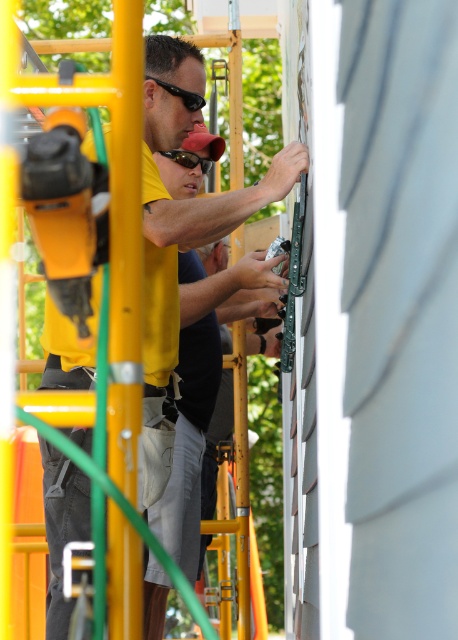
You are a safety inspector observing the construction site. You notice the yellow matte shirt at center and the black plastic goggles at upper center. Which object is closer to you?

The yellow matte shirt at center is closer to you because it is further to the viewer than the black plastic goggles at upper center.

You are a safety inspector checking the equipment on the scaffolding. You notice the yellow matte shirt at center and the black plastic goggles at upper center. Which object has a smaller width?

The yellow matte shirt at center has a smaller width than the black plastic goggles at upper center according to the description.

You are a safety inspector checking the construction site. You notice two pairs of black plastic goggles at center and black plastic goggles at upper center. Which pair is positioned farther from the observer?

The black plastic goggles at upper center is behind black plastic goggles at center, so it is farther from the observer.